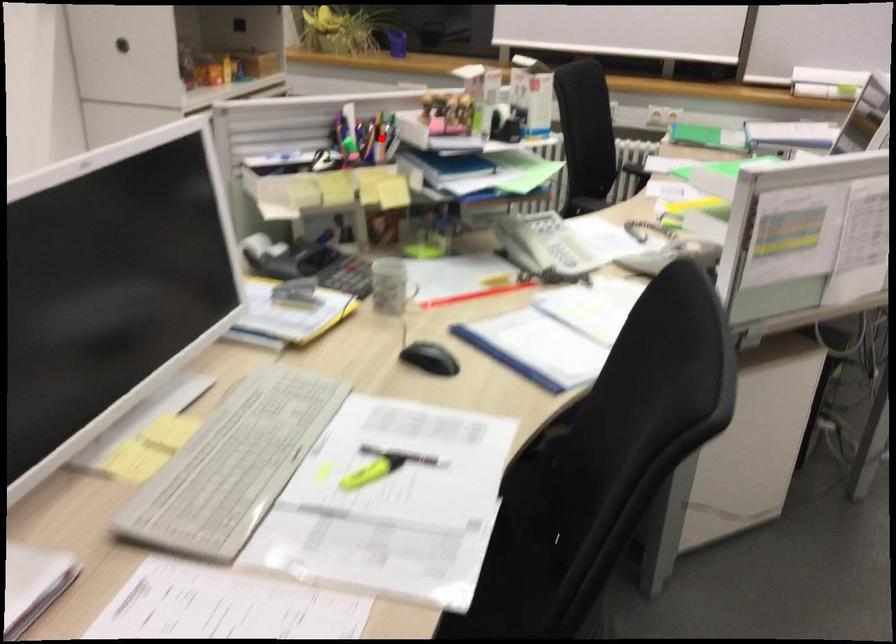
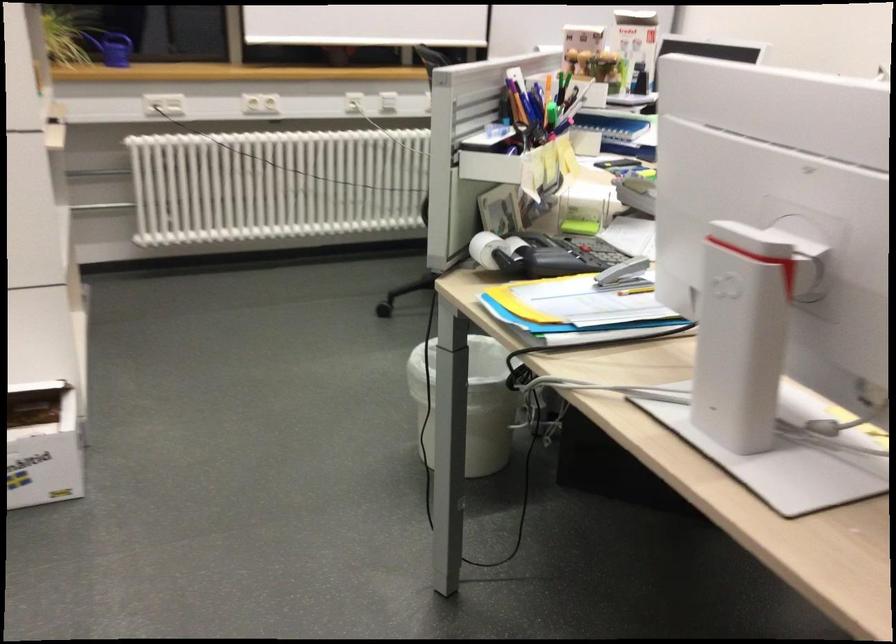
Question: I am providing you with two images of the same scene from different viewpoints. Given a red point in image1, look at the same physical point in image2. Is it:

Choices:
 (A) Closer to the viewpoint
 (B) Farther from the viewpoint

Answer: (A)